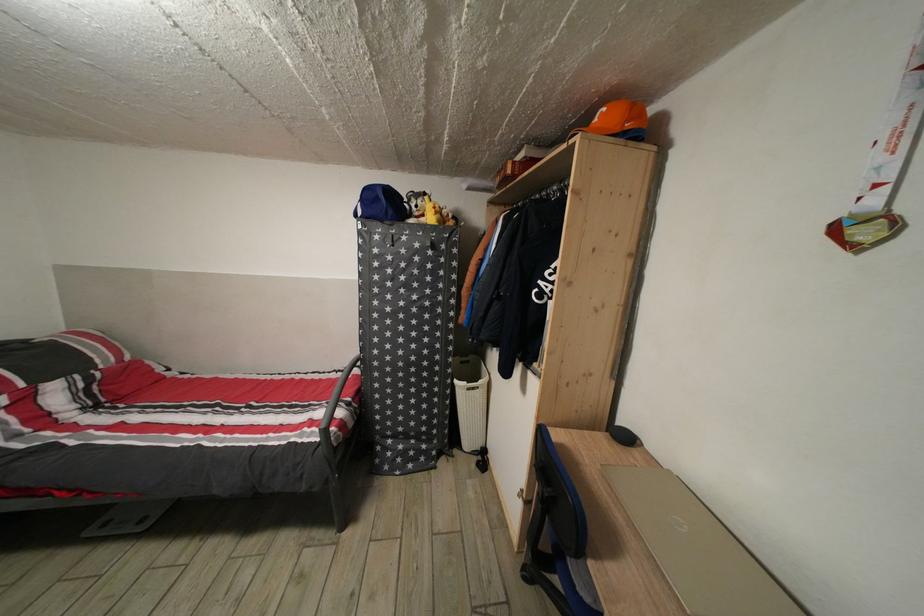
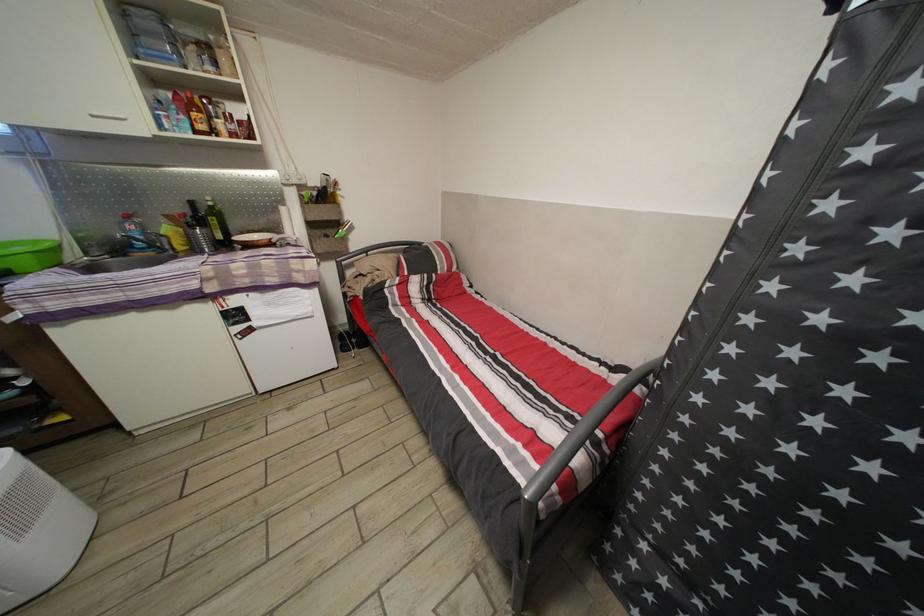
The first image is from the beginning of the video and the second image is from the end. How did the camera likely rotate when shooting the video?

The camera's rotation is toward left-down.